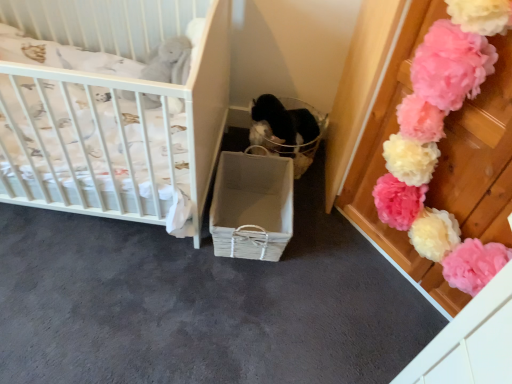
The height and width of the screenshot is (384, 512). What are the coordinates of `free space in front of white wicker crib at left` in the screenshot? It's located at (89, 294).